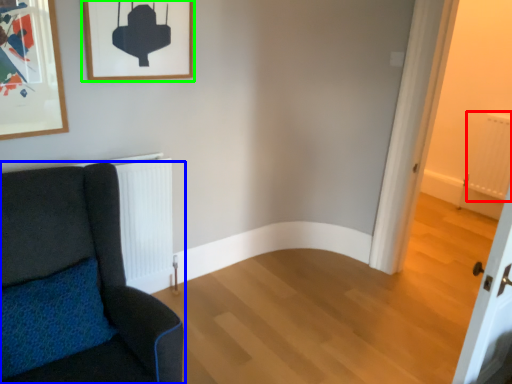
Question: Which object is the farthest from radiator (highlighted by a red box)? Choose among these: chair (highlighted by a blue box) or picture frame (highlighted by a green box).

Choices:
 (A) chair
 (B) picture frame

Answer: (A)